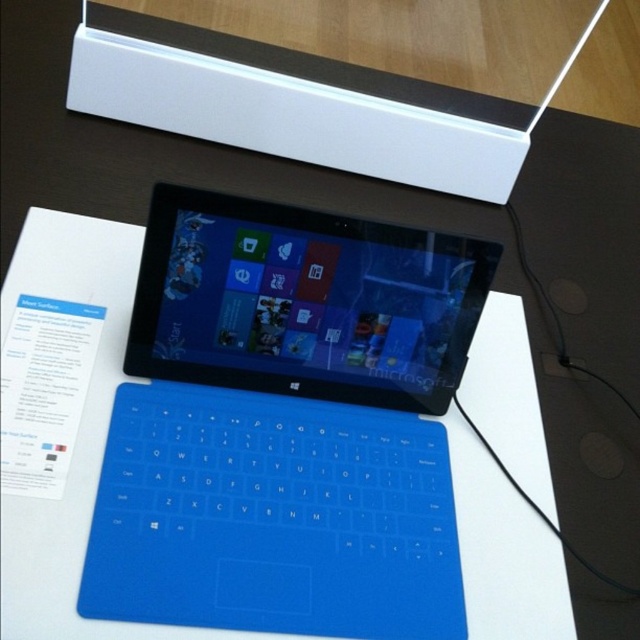
Between blue matte keyboard at center and white plastic box at upper center, which one is positioned lower?

blue matte keyboard at center

This screenshot has width=640, height=640. Identify the location of blue matte keyboard at center. (285, 424).

This screenshot has width=640, height=640. What do you see at coordinates (285, 424) in the screenshot?
I see `blue matte keyboard at center` at bounding box center [285, 424].

Locate an element on the screen. blue matte keyboard at center is located at coordinates (285, 424).